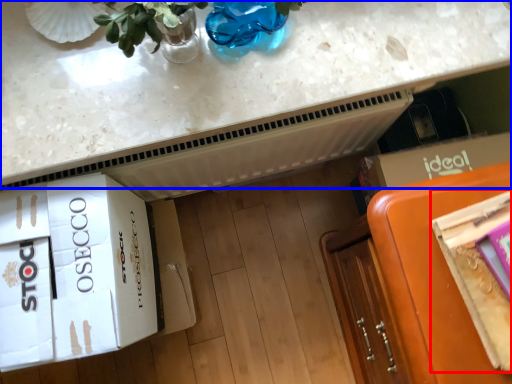
Question: Which point is closer to the camera, magazine (highlighted by a red box) or countertop (highlighted by a blue box)?

Choices:
 (A) magazine
 (B) countertop

Answer: (A)